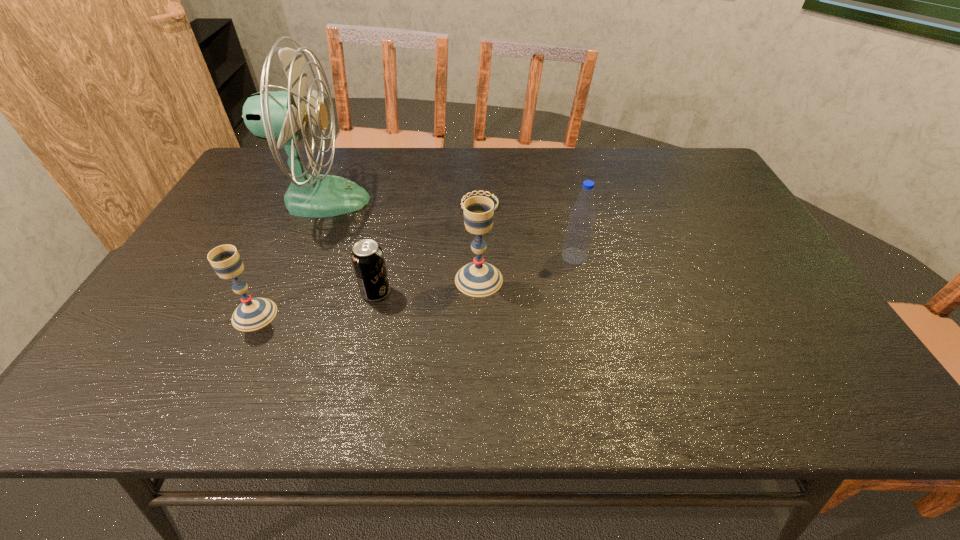
At what (x,y) coordinates should I click in order to perform the action: click on vacant region at the near edge of the desktop. Please return your answer as a coordinate pair (x, y). This screenshot has height=540, width=960. Looking at the image, I should click on (444, 342).

Where is `vacant point at the left edge`? vacant point at the left edge is located at coordinates (247, 253).

In the image, there is a desktop. In order to click on vacant area at the right edge in this screenshot , I will do `click(792, 292)`.

Locate an element on the screen. free spot at the near left corner of the desktop is located at coordinates (195, 334).

The image size is (960, 540). In the image, there is a desktop. What are the coordinates of `free space at the far right corner` in the screenshot? It's located at (682, 171).

What are the coordinates of `free space between the fan and the water bottle` in the screenshot? It's located at (448, 228).

This screenshot has width=960, height=540. Find the location of `free space between the soda can and the shortest object`. free space between the soda can and the shortest object is located at coordinates (428, 249).

What are the coordinates of `empty location between the fan and the shortest object` in the screenshot? It's located at (400, 202).

I want to click on free space between the rightmost object and the taller chalice, so click(527, 268).

Locate an element on the screen. This screenshot has height=540, width=960. empty space between the shorter chalice and the fan is located at coordinates (288, 257).